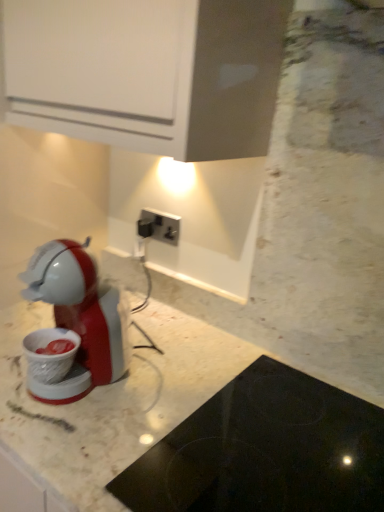
Question: From a real-world perspective, is black glass cooktop at lower center positioned over black plastic power plugs and sockets at center based on gravity?

Choices:
 (A) yes
 (B) no

Answer: (B)

Question: Is black glass cooktop at lower center oriented towards black plastic power plugs and sockets at center?

Choices:
 (A) no
 (B) yes

Answer: (A)

Question: Is black glass cooktop at lower center smaller than black plastic power plugs and sockets at center?

Choices:
 (A) yes
 (B) no

Answer: (B)

Question: Is the position of black glass cooktop at lower center more distant than that of black plastic power plugs and sockets at center?

Choices:
 (A) yes
 (B) no

Answer: (B)

Question: Is black glass cooktop at lower center touching black plastic power plugs and sockets at center?

Choices:
 (A) yes
 (B) no

Answer: (B)

Question: Is black glass cooktop at lower center completely or partially outside of black plastic power plugs and sockets at center?

Choices:
 (A) no
 (B) yes

Answer: (B)

Question: From a real-world perspective, is black plastic power plugs and sockets at center over black glass cooktop at lower center?

Choices:
 (A) yes
 (B) no

Answer: (A)

Question: From a real-world perspective, is black plastic power plugs and sockets at center below black glass cooktop at lower center?

Choices:
 (A) yes
 (B) no

Answer: (B)

Question: Does black plastic power plugs and sockets at center have a greater width compared to black glass cooktop at lower center?

Choices:
 (A) no
 (B) yes

Answer: (A)

Question: Does black plastic power plugs and sockets at center turn towards black glass cooktop at lower center?

Choices:
 (A) yes
 (B) no

Answer: (B)

Question: Is black plastic power plugs and sockets at center positioned before black glass cooktop at lower center?

Choices:
 (A) yes
 (B) no

Answer: (B)

Question: Does black plastic power plugs and sockets at center have a smaller size compared to black glass cooktop at lower center?

Choices:
 (A) yes
 (B) no

Answer: (A)

Question: Is point (162, 227) positioned closer to the camera than point (157, 499)?

Choices:
 (A) farther
 (B) closer

Answer: (A)